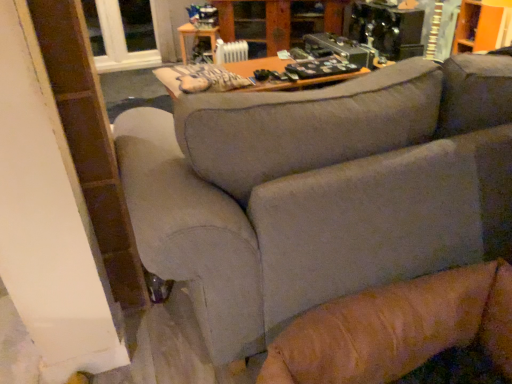
Question: Considering the relative sizes of wooden cabinet at upper center and white plastic radiator at upper center in the image provided, is wooden cabinet at upper center thinner than white plastic radiator at upper center?

Choices:
 (A) no
 (B) yes

Answer: (A)

Question: Is wooden cabinet at upper center next to white plastic radiator at upper center and touching it?

Choices:
 (A) yes
 (B) no

Answer: (B)

Question: Does wooden cabinet at upper center lie in front of white plastic radiator at upper center?

Choices:
 (A) no
 (B) yes

Answer: (B)

Question: Can you confirm if wooden cabinet at upper center is taller than white plastic radiator at upper center?

Choices:
 (A) no
 (B) yes

Answer: (B)

Question: From a real-world perspective, is wooden cabinet at upper center over white plastic radiator at upper center?

Choices:
 (A) yes
 (B) no

Answer: (A)

Question: Does point (225, 38) appear closer or farther from the camera than point (215, 33)?

Choices:
 (A) farther
 (B) closer

Answer: (A)

Question: From their relative heights in the image, would you say wooden cabinet at upper center is taller or shorter than wooden table at center?

Choices:
 (A) short
 (B) tall

Answer: (B)

Question: Considering their positions, is wooden cabinet at upper center located in front of or behind wooden table at center?

Choices:
 (A) behind
 (B) front

Answer: (B)

Question: Looking at the image, does wooden cabinet at upper center seem bigger or smaller compared to wooden table at center?

Choices:
 (A) big
 (B) small

Answer: (A)

Question: Based on their sizes in the image, would you say white plastic radiator at upper center is bigger or smaller than clear glass window at upper left?

Choices:
 (A) small
 (B) big

Answer: (A)

Question: Considering the positions of white plastic radiator at upper center and clear glass window at upper left in the image, is white plastic radiator at upper center taller or shorter than clear glass window at upper left?

Choices:
 (A) tall
 (B) short

Answer: (B)

Question: Would you say white plastic radiator at upper center is to the left or to the right of clear glass window at upper left in the picture?

Choices:
 (A) left
 (B) right

Answer: (B)

Question: Considering the positions of white plastic radiator at upper center and clear glass window at upper left in the image, is white plastic radiator at upper center wider or thinner than clear glass window at upper left?

Choices:
 (A) thin
 (B) wide

Answer: (A)

Question: Is gray fabric couch at center to the left or to the right of clear glass window at upper left in the image?

Choices:
 (A) right
 (B) left

Answer: (A)

Question: From a real-world perspective, is gray fabric couch at center physically located above or below clear glass window at upper left?

Choices:
 (A) below
 (B) above

Answer: (B)